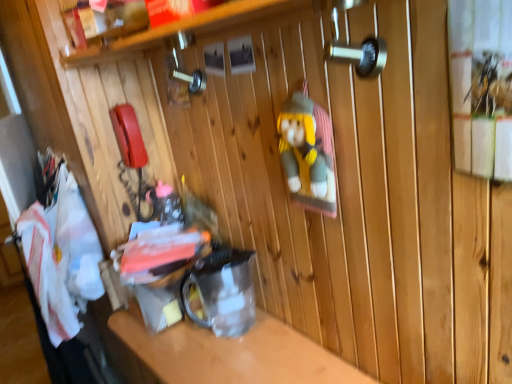
Question: From the image's perspective, is white fabric at left positioned above or below clear plastic container at center?

Choices:
 (A) above
 (B) below

Answer: (A)

Question: Visually, is white fabric at left positioned to the left or to the right of clear plastic container at center?

Choices:
 (A) right
 (B) left

Answer: (B)

Question: Considering the positions of white fabric at left and clear plastic container at center in the image, is white fabric at left wider or thinner than clear plastic container at center?

Choices:
 (A) wide
 (B) thin

Answer: (B)

Question: From a real-world perspective, is clear plastic container at center physically located above or below white fabric at left?

Choices:
 (A) above
 (B) below

Answer: (B)

Question: Considering the positions of clear plastic container at center and white fabric at left in the image, is clear plastic container at center bigger or smaller than white fabric at left?

Choices:
 (A) big
 (B) small

Answer: (A)

Question: Does point (160, 362) appear closer or farther from the camera than point (74, 332)?

Choices:
 (A) closer
 (B) farther

Answer: (A)

Question: Is clear plastic container at center in front of or behind white fabric at left in the image?

Choices:
 (A) behind
 (B) front

Answer: (B)